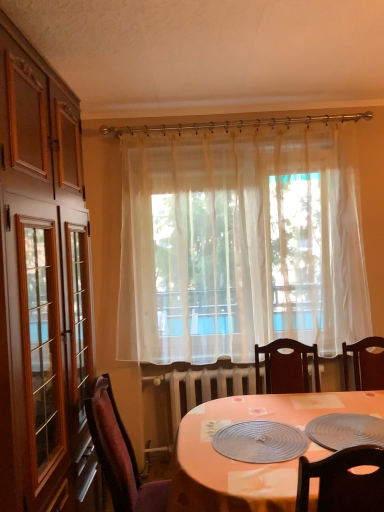
You are a GUI agent. You are given a task and a screenshot of the screen. Output one action in this format:
    pyautogui.click(x=<x>, y=<y>)
    Task: Click on the sheer white curtain at center
    
    Given the screenshot: What is the action you would take?
    [x=240, y=245]

Measure the distance between point (86, 405) and camera.

They are 1.78 meters apart.

Identify the location of velvet burgundy chair at lower left. (119, 453).

Identify the location of metallic textured platter at center, the 1th platter when ordered from left to right. (260, 442).

Locate an element on the screen. This screenshot has width=384, height=512. orange fabric table at center is located at coordinates (249, 463).

Considering the sizes of objects metallic textured platter at center, the 1th platter when ordered from left to right, and orange fabric table at center in the image provided, who is wider, metallic textured platter at center, the 1th platter when ordered from left to right, or orange fabric table at center?

Wider between the two is orange fabric table at center.

Does metallic textured platter at center, which is the 2th platter from right to left, contain orange fabric table at center?

No, orange fabric table at center is not inside metallic textured platter at center, which is the 2th platter from right to left.

Which of these two, metallic textured platter at center, which is the 2th platter from right to left, or orange fabric table at center, is smaller?

metallic textured platter at center, which is the 2th platter from right to left.

From a real-world perspective, who is located higher, metallic textured platter at center, the 1th platter when ordered from left to right, or orange fabric table at center?

metallic textured platter at center, the 1th platter when ordered from left to right, is physically above.

How far apart are sheer white curtain at center and metallic silver platter at lower right, the 2th platter from the left?

sheer white curtain at center and metallic silver platter at lower right, the 2th platter from the left, are 4.04 feet apart from each other.

The width and height of the screenshot is (384, 512). There is a metallic silver platter at lower right, the 2th platter from the left. Identify the location of curtain above it (from a real-world perspective). (240, 245).

Which is more to the left, sheer white curtain at center or metallic silver platter at lower right, which is the 1th platter in right-to-left order?

sheer white curtain at center.

Is sheer white curtain at center not close to metallic silver platter at lower right, which is the 1th platter in right-to-left order?

Yes, sheer white curtain at center and metallic silver platter at lower right, which is the 1th platter in right-to-left order, are located far from each other.

Consider the image. Is velvet burgundy chair at lower left surrounded by metallic silver platter at lower right, the 2th platter from the left?

No, velvet burgundy chair at lower left is not surrounded by metallic silver platter at lower right, the 2th platter from the left.

Which of these two, metallic silver platter at lower right, which is the 1th platter in right-to-left order, or velvet burgundy chair at lower left, stands taller?

With more height is velvet burgundy chair at lower left.

From the image's perspective, is metallic silver platter at lower right, the 2th platter from the left, under velvet burgundy chair at lower left?

Incorrect, from the image's perspective, metallic silver platter at lower right, the 2th platter from the left, is higher than velvet burgundy chair at lower left.

Does metallic silver platter at lower right, the 2th platter from the left, have a lesser width compared to velvet burgundy chair at lower left?

Indeed, metallic silver platter at lower right, the 2th platter from the left, has a lesser width compared to velvet burgundy chair at lower left.

Can you tell me how much metallic silver platter at lower right, the 2th platter from the left, and metallic textured platter at center, the 1th platter when ordered from left to right, differ in facing direction?

0.000739 degrees separate the facing orientations of metallic silver platter at lower right, the 2th platter from the left, and metallic textured platter at center, the 1th platter when ordered from left to right.

Which of these two, metallic silver platter at lower right, the 2th platter from the left, or metallic textured platter at center, the 1th platter when ordered from left to right, is bigger?

With larger size is metallic silver platter at lower right, the 2th platter from the left.

Is metallic silver platter at lower right, which is the 1th platter in right-to-left order, touching metallic textured platter at center, which is the 2th platter from right to left?

No.

Can you confirm if metallic silver platter at lower right, the 2th platter from the left, is positioned to the right of metallic textured platter at center, which is the 2th platter from right to left?

Yes, metallic silver platter at lower right, the 2th platter from the left, is to the right of metallic textured platter at center, which is the 2th platter from right to left.

Looking at this image, do you think metallic silver platter at lower right, which is the 1th platter in right-to-left order, is within sheer white curtain at center, or outside of it?

metallic silver platter at lower right, which is the 1th platter in right-to-left order, cannot be found inside sheer white curtain at center.

Does metallic silver platter at lower right, the 2th platter from the left, touch sheer white curtain at center?

No, metallic silver platter at lower right, the 2th platter from the left, is not making contact with sheer white curtain at center.

Which is in front, point (351, 439) or point (193, 174)?

The point (351, 439) is more forward.

How far apart are metallic silver platter at lower right, which is the 1th platter in right-to-left order, and sheer white curtain at center?

metallic silver platter at lower right, which is the 1th platter in right-to-left order, and sheer white curtain at center are 1.23 meters apart.

From a real-world perspective, between velvet burgundy chair at lower left and metallic silver platter at lower right, which is the 1th platter in right-to-left order, who is vertically lower?

velvet burgundy chair at lower left is physically lower.

Between point (116, 406) and point (376, 434), which one is positioned in front?

The point (376, 434) is closer.

Which is in front, velvet burgundy chair at lower left or metallic silver platter at lower right, which is the 1th platter in right-to-left order?

metallic silver platter at lower right, which is the 1th platter in right-to-left order, is more forward.

Considering the sizes of objects velvet burgundy chair at lower left and metallic silver platter at lower right, the 2th platter from the left, in the image provided, who is smaller, velvet burgundy chair at lower left or metallic silver platter at lower right, the 2th platter from the left,?

With smaller size is metallic silver platter at lower right, the 2th platter from the left.

Between orange fabric table at center and metallic silver platter at lower right, the 2th platter from the left, which one has larger size?

orange fabric table at center is bigger.

Could you tell me if orange fabric table at center is turned towards metallic silver platter at lower right, the 2th platter from the left?

No.

Is orange fabric table at center situated inside metallic silver platter at lower right, the 2th platter from the left, or outside?

The correct answer is: outside.

From the picture: Does orange fabric table at center appear on the left side of metallic silver platter at lower right, which is the 1th platter in right-to-left order?

Correct, you'll find orange fabric table at center to the left of metallic silver platter at lower right, which is the 1th platter in right-to-left order.

The width and height of the screenshot is (384, 512). In order to click on the 2nd platter behind the orange fabric table at center, starting your count from the anchor in this screenshot , I will do `click(260, 442)`.

Locate an element on the screen. This screenshot has height=512, width=384. curtain above the metallic silver platter at lower right, the 2th platter from the left (from the image's perspective) is located at coordinates (240, 245).

From the image, which object appears to be nearer to metallic textured platter at center, the 1th platter when ordered from left to right, metallic silver platter at lower right, which is the 1th platter in right-to-left order, or orange fabric table at center?

orange fabric table at center is closer to metallic textured platter at center, the 1th platter when ordered from left to right.

From the image, which object appears to be farther from velvet burgundy chair at lower left, orange fabric table at center or metallic textured platter at center, the 1th platter when ordered from left to right?

metallic textured platter at center, the 1th platter when ordered from left to right, lies further to velvet burgundy chair at lower left than the other object.

Looking at the image, which one is located closer to metallic textured platter at center, the 1th platter when ordered from left to right, velvet burgundy chair at lower left or sheer white curtain at center?

Among the two, velvet burgundy chair at lower left is located nearer to metallic textured platter at center, the 1th platter when ordered from left to right.

From the image, which object appears to be farther from sheer white curtain at center, metallic silver platter at lower right, the 2th platter from the left, or velvet burgundy chair at lower left?

Based on the image, metallic silver platter at lower right, the 2th platter from the left, appears to be further to sheer white curtain at center.

Based on their spatial positions, is metallic textured platter at center, the 1th platter when ordered from left to right, or sheer white curtain at center further from velvet burgundy chair at lower left?

sheer white curtain at center is further to velvet burgundy chair at lower left.

Based on the photo, looking at the image, which one is located closer to metallic textured platter at center, which is the 2th platter from right to left, velvet burgundy chair at lower left or orange fabric table at center?

orange fabric table at center.

Looking at the image, which one is located further to velvet burgundy chair at lower left, orange fabric table at center or sheer white curtain at center?

sheer white curtain at center is further to velvet burgundy chair at lower left.

Considering their positions, is metallic textured platter at center, the 1th platter when ordered from left to right, positioned closer to velvet burgundy chair at lower left than orange fabric table at center?

orange fabric table at center is positioned closer to the anchor velvet burgundy chair at lower left.

Identify the location of chair between metallic textured platter at center, which is the 2th platter from right to left, and sheer white curtain at center in the front-back direction. The image size is (384, 512). (119, 453).

Identify the location of platter between velvet burgundy chair at lower left and metallic silver platter at lower right, the 2th platter from the left, in the horizontal direction. The width and height of the screenshot is (384, 512). tap(260, 442).

Where is `chair between metallic silver platter at lower right, which is the 1th platter in right-to-left order, and sheer white curtain at center from front to back`? This screenshot has height=512, width=384. chair between metallic silver platter at lower right, which is the 1th platter in right-to-left order, and sheer white curtain at center from front to back is located at coordinates (119, 453).

Find the location of a particular element. platter positioned between metallic silver platter at lower right, which is the 1th platter in right-to-left order, and sheer white curtain at center from near to far is located at coordinates (260, 442).